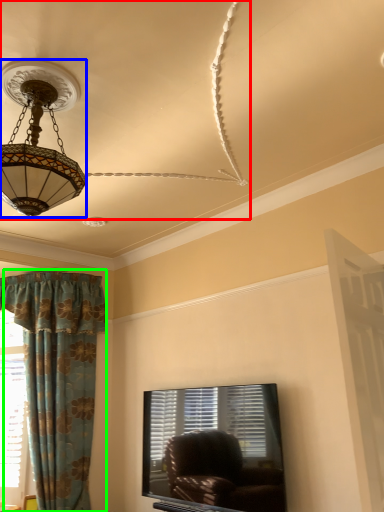
Question: Considering the real-world distances, which object is closest to fan (highlighted by a red box)? lamp (highlighted by a blue box) or curtain (highlighted by a green box).

Choices:
 (A) lamp
 (B) curtain

Answer: (A)